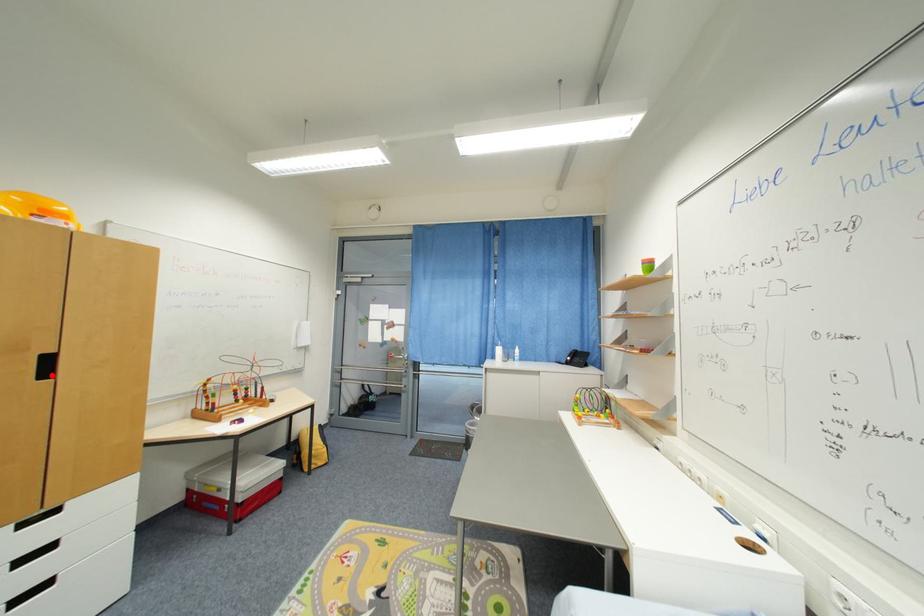
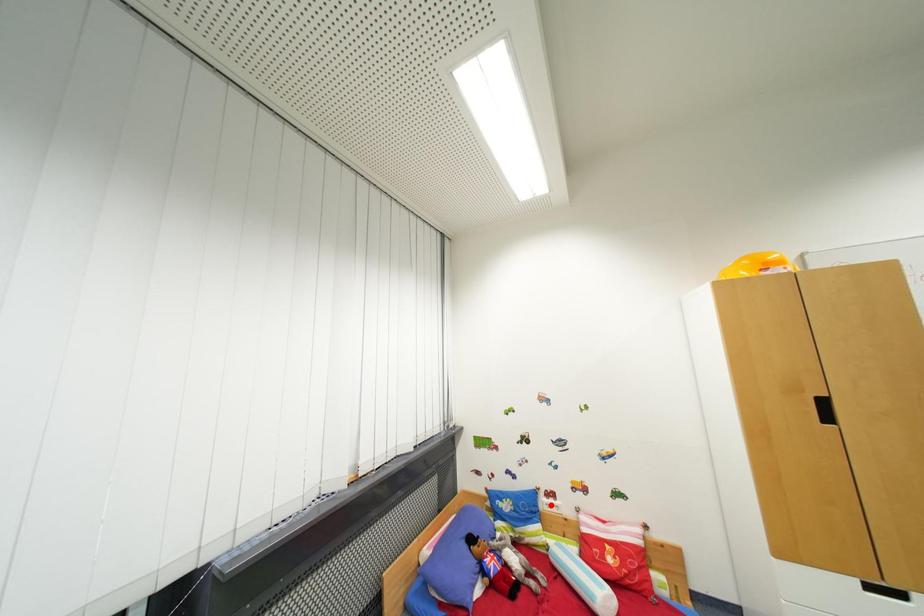
I am providing you with two images of the same scene from different viewpoints. A red point is marked on the first image and another point is marked on the second image. Are the points marked in image1 and image2 representing the same 3D position?

No